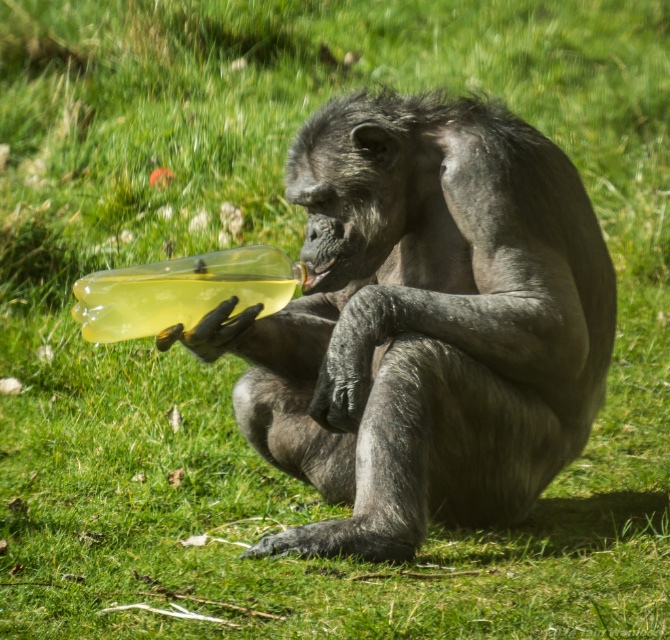
In the scene shown: Does shiny plastic bottle at center have a greater height compared to translucent yellow bottle at lower left?

Yes, shiny plastic bottle at center is taller than translucent yellow bottle at lower left.

Who is shorter, shiny plastic bottle at center or translucent yellow bottle at lower left?

translucent yellow bottle at lower left is shorter.

The width and height of the screenshot is (670, 640). What do you see at coordinates (423, 323) in the screenshot? I see `shiny plastic bottle at center` at bounding box center [423, 323].

Locate an element on the screen. The height and width of the screenshot is (640, 670). shiny plastic bottle at center is located at coordinates (423, 323).